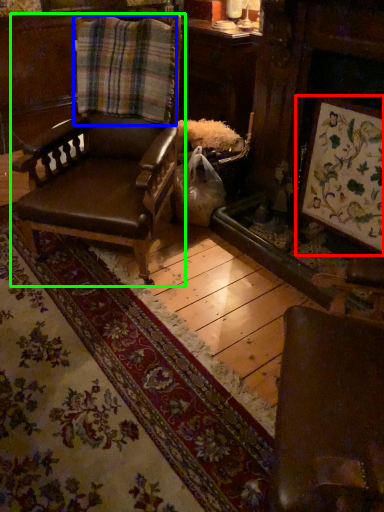
Question: Estimate the real-world distances between objects in this image. Which object is farther from picture frame (highlighted by a red box), plaid (highlighted by a blue box) or chair (highlighted by a green box)?

Choices:
 (A) plaid
 (B) chair

Answer: (A)